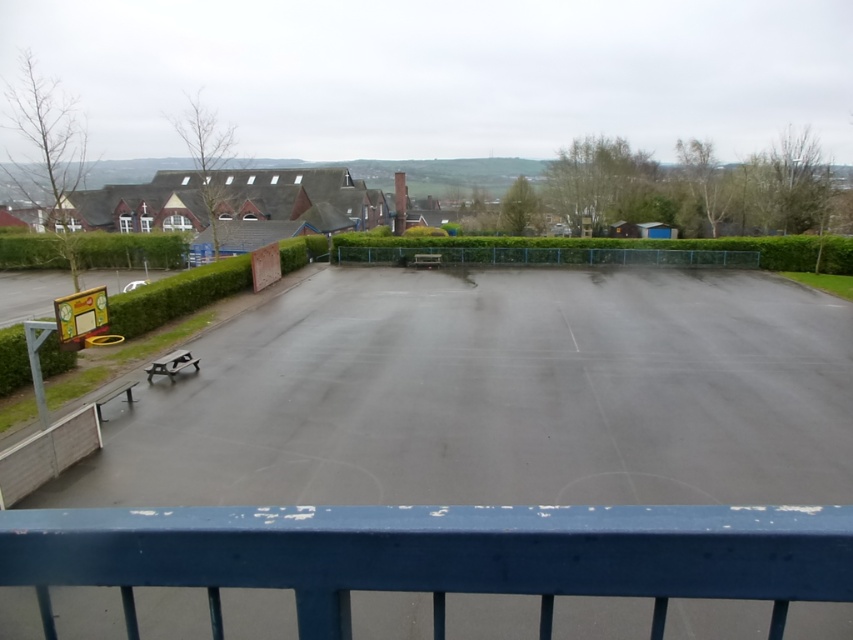
Who is more forward, (518,522) or (171,241)?

Point (518,522)

Measure the distance between smooth blue railing at center and camera.

smooth blue railing at center and camera are 35.65 inches apart.

Where is `smooth blue railing at center`? smooth blue railing at center is located at coordinates (434, 554).

Between smooth asphalt skate park at center and green leafy hedge at left, which one has less height?

Standing shorter between the two is green leafy hedge at left.

Is smooth asphalt skate park at center above green leafy hedge at left?

No, smooth asphalt skate park at center is not above green leafy hedge at left.

Which is in front, point (236, 336) or point (144, 252)?

Point (236, 336) is in front.

Find the location of a particular element. The width and height of the screenshot is (853, 640). smooth asphalt skate park at center is located at coordinates (460, 456).

Is point (440, 356) positioned behind point (648, 547)?

Yes, it is.

Can you confirm if smooth asphalt skate park at center is wider than smooth blue railing at center?

Yes.

The width and height of the screenshot is (853, 640). What do you see at coordinates (460, 456) in the screenshot?
I see `smooth asphalt skate park at center` at bounding box center [460, 456].

At what (x,y) coordinates should I click in order to perform the action: click on smooth asphalt skate park at center. Please return your answer as a coordinate pair (x, y). Image resolution: width=853 pixels, height=640 pixels. Looking at the image, I should click on (460, 456).